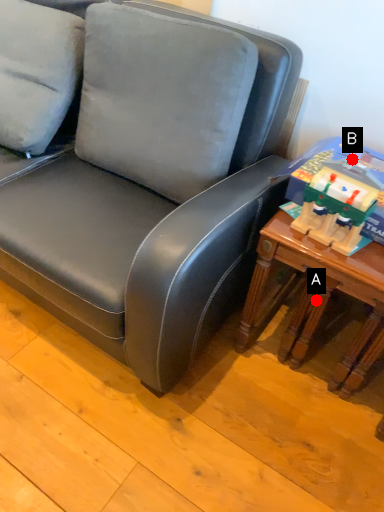
Question: Two points are circled on the image, labeled by A and B beside each circle. Which point appears farthest from the camera in this image?

Choices:
 (A) A is further
 (B) B is further

Answer: (A)